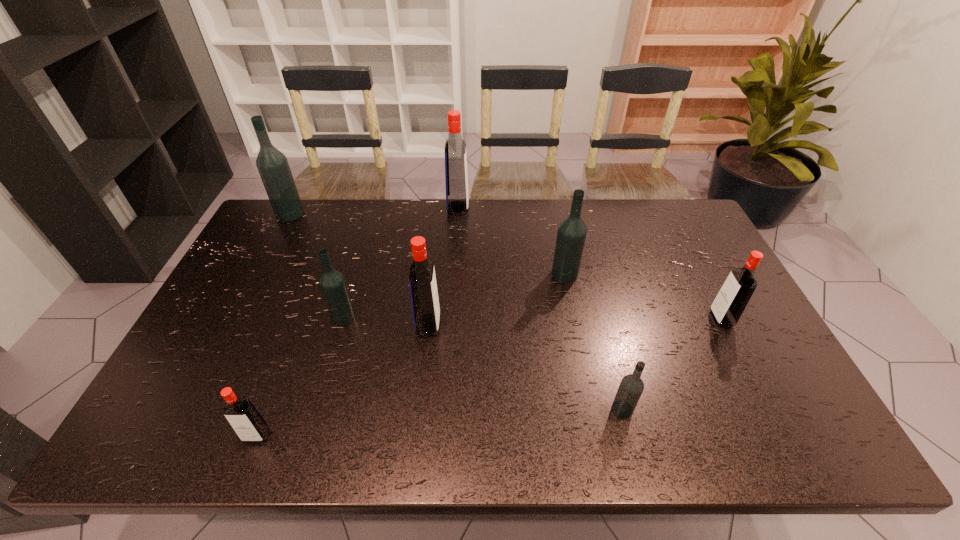
Identify the location of free location that satisfies the following two spatial constraints: 1. on the back side of the nearest black vodka; 2. on the front and back of the biggest red vodka. The image size is (960, 540). (571, 208).

This screenshot has height=540, width=960. In order to click on free location that satisfies the following two spatial constraints: 1. on the front side of the sixth object from left to right; 2. on the right side of the seventh vodka from left to right in this screenshot , I will do click(x=591, y=409).

Locate an element on the screen. This screenshot has height=540, width=960. vacant space that satisfies the following two spatial constraints: 1. on the front and back of the farthest red vodka; 2. on the front and back of the leftmost red vodka is located at coordinates (444, 435).